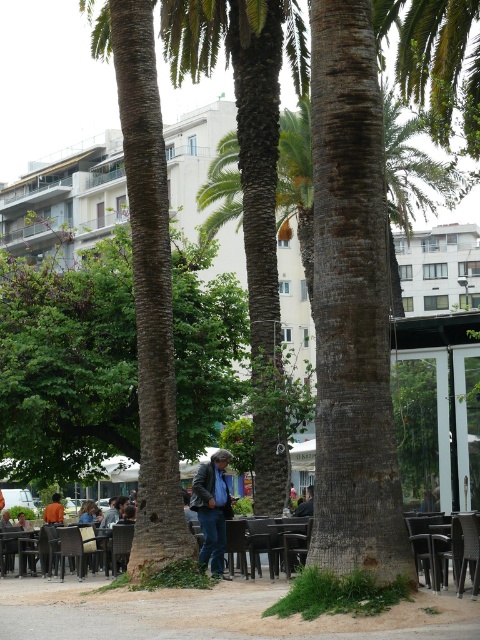
Can you confirm if black plastic chair at lower center is bigger than metallic silver chair at lower left?

No.

The image size is (480, 640). What do you see at coordinates (262, 541) in the screenshot?
I see `black plastic chair at lower center` at bounding box center [262, 541].

Is point (247, 536) closer to viewer compared to point (130, 548)?

Yes, it is in front of point (130, 548).

What are the coordinates of `black plastic chair at lower center` in the screenshot? It's located at (262, 541).

Looking at this image, does rustic wood chair at lower left have a lesser height compared to denim jacket at lower center?

Indeed, rustic wood chair at lower left has a lesser height compared to denim jacket at lower center.

Which is in front, point (72, 532) or point (309, 513)?

Point (72, 532) is in front.

Does point (95, 540) come in front of point (297, 508)?

Yes, point (95, 540) is closer to viewer.

Locate an element on the screen. The image size is (480, 640). rustic wood chair at lower left is located at coordinates (76, 545).

Is point (116, 570) less distant than point (52, 516)?

Yes, it is.

Which is below, metallic silver chair at lower left or orange shirt at center?

Positioned lower is orange shirt at center.

Which is in front, point (119, 525) or point (60, 512)?

Point (119, 525) is in front.

The height and width of the screenshot is (640, 480). Find the location of `metallic silver chair at lower left`. metallic silver chair at lower left is located at coordinates (120, 544).